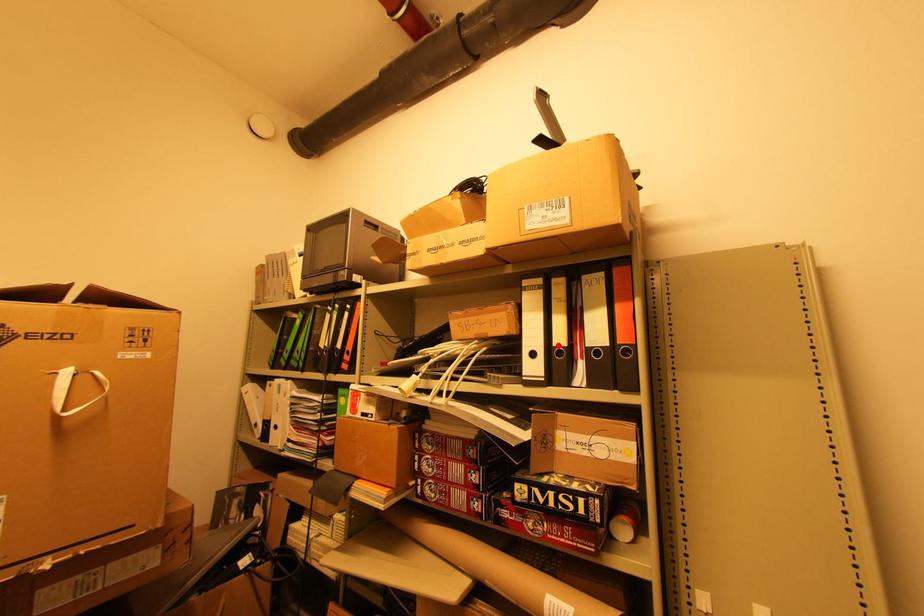
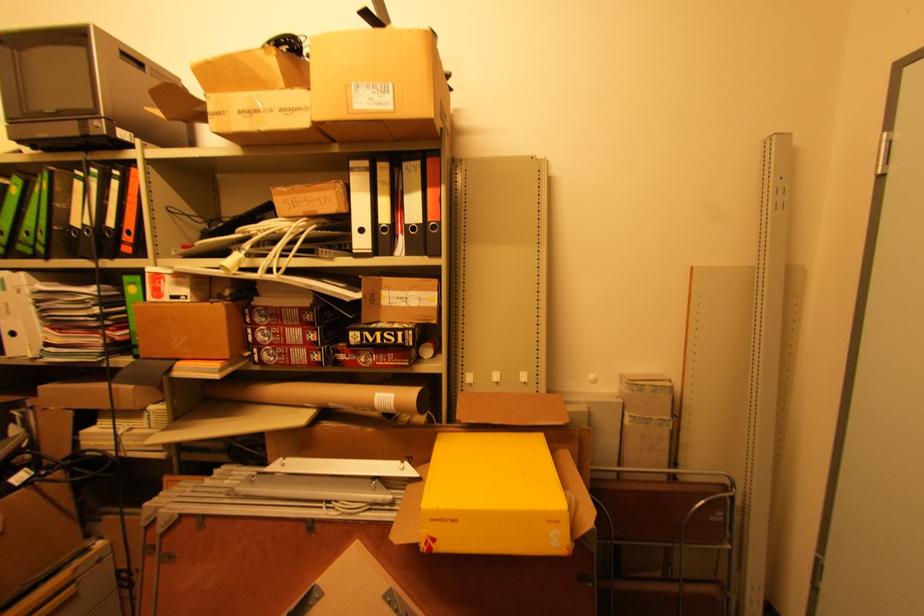
In the second image, find the point that corresponds to the highlighted location in the first image.

(383, 223)